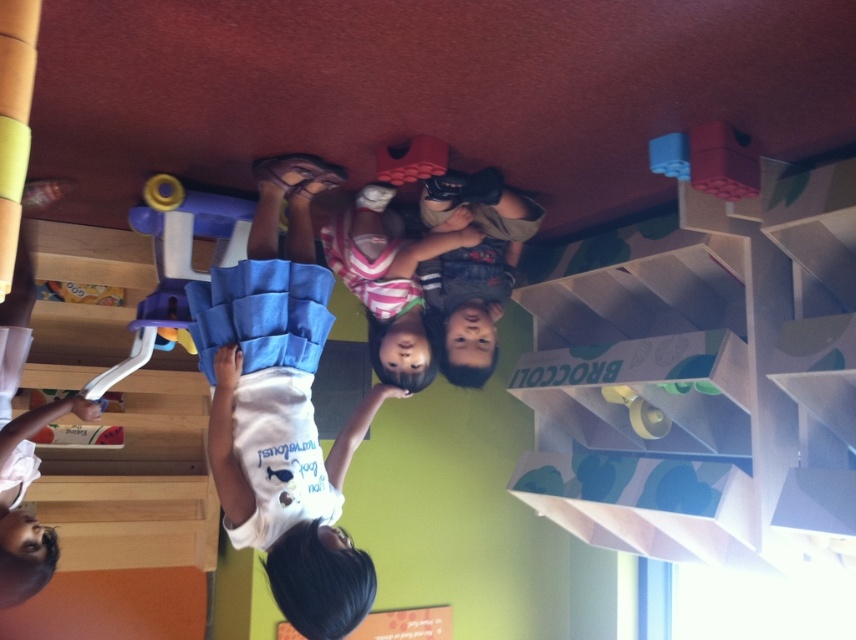
Can you confirm if white cotton shirt at center is positioned below striped fabric shirt at center?

Indeed, white cotton shirt at center is positioned under striped fabric shirt at center.

Which is more to the left, white cotton shirt at center or striped fabric shirt at center?

white cotton shirt at center is more to the left.

Is point (296, 497) less distant than point (403, 272)?

Yes, point (296, 497) is closer to viewer.

The height and width of the screenshot is (640, 856). What are the coordinates of `white cotton shirt at center` in the screenshot? It's located at (282, 406).